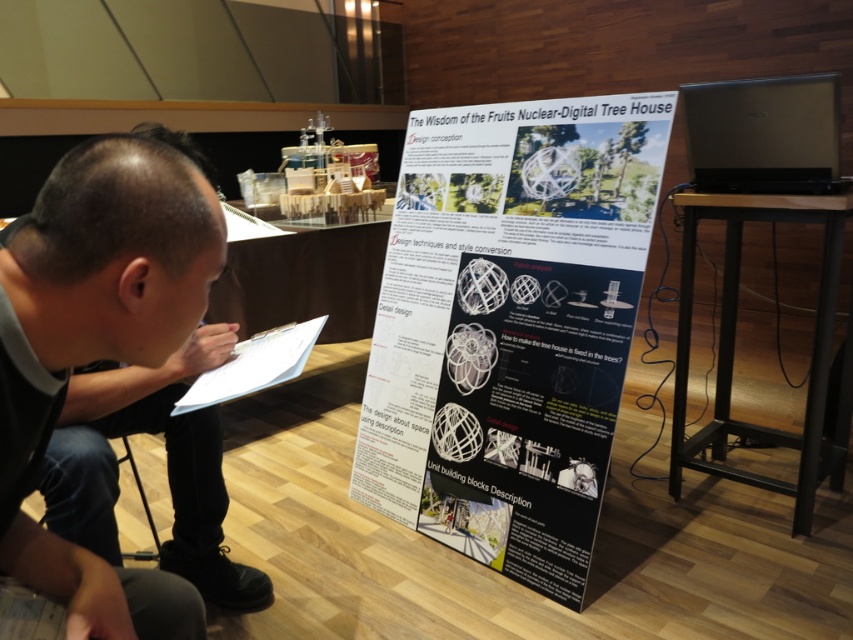
You are a presenter standing in front of the display board. You need to move to the right side of the room to adjust the lighting. The black fabric pants at lower left and the black plastic stool at lower left are in your path. Can you walk through the space between them without stepping on either?

The distance between the black fabric pants at lower left and the black plastic stool at lower left is 10.48 inches. Since this space is narrow, it might be challenging to walk through without stepping on either object. It is recommended to find an alternative path or move the stool temporarily for safer navigation.

You are a security guard in the exhibition hall. You need to determine if the black fabric pants at lower left can be placed on top of the black plastic stool at lower left without falling off. Can you confirm this?

The black fabric pants at lower left is bigger than black plastic stool at lower left, so placing them on top would likely cause them to fall off due to the larger size exceeding the stool surface area.